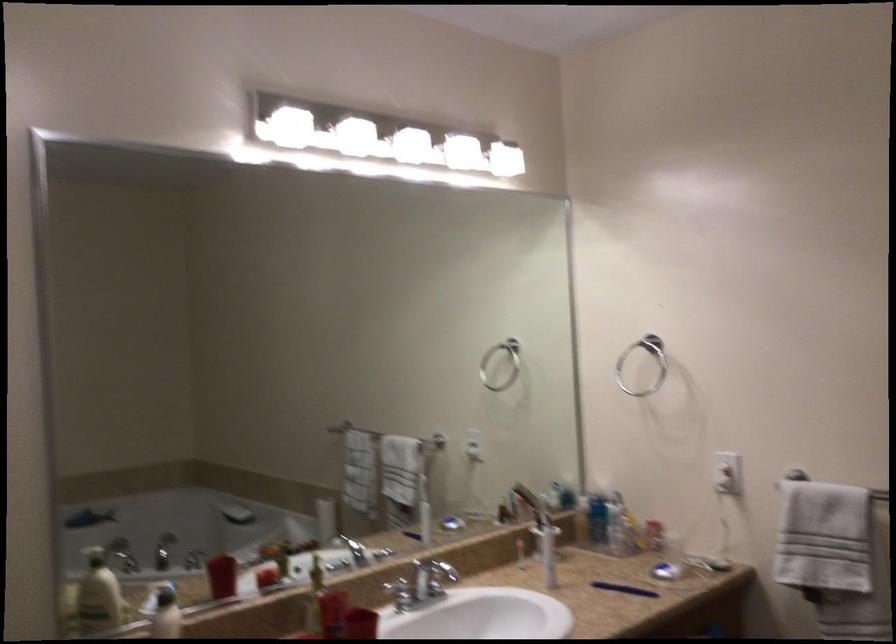
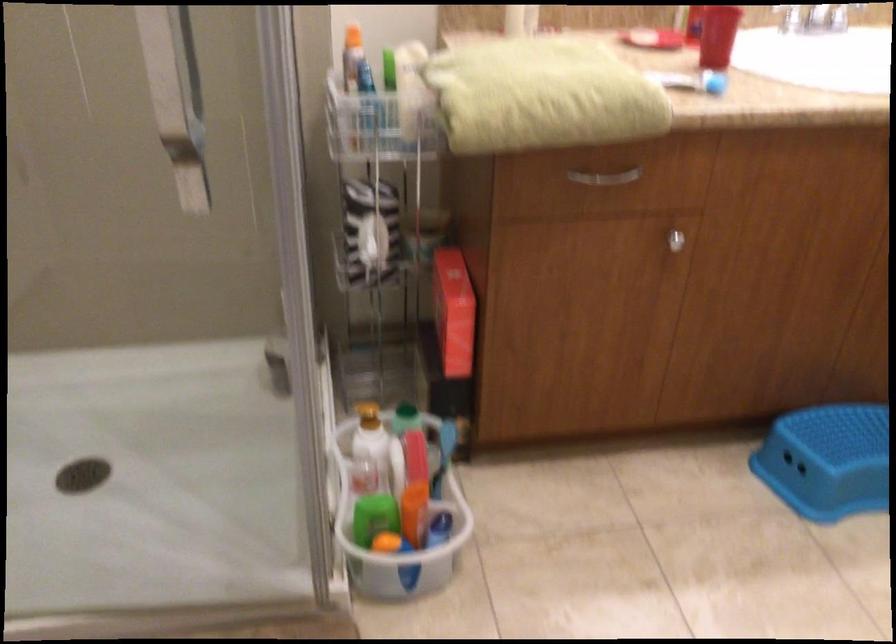
First-person continuous shooting, in which direction is the camera rotating?

The rotation direction of the camera is left-down.